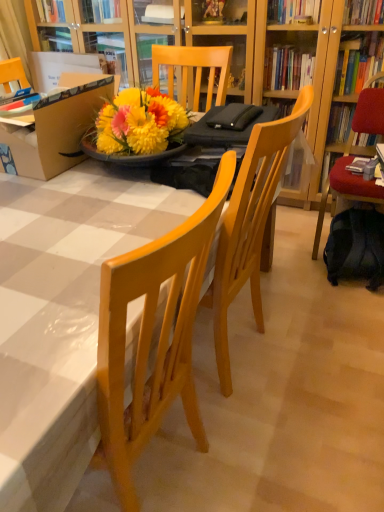
At what (x,y) coordinates should I click in order to perform the action: click on empty space that is ontop of dark blue fabric backpack at lower right. Please return your answer as a coordinate pair (x, y). The image size is (384, 512). Looking at the image, I should click on [361, 223].